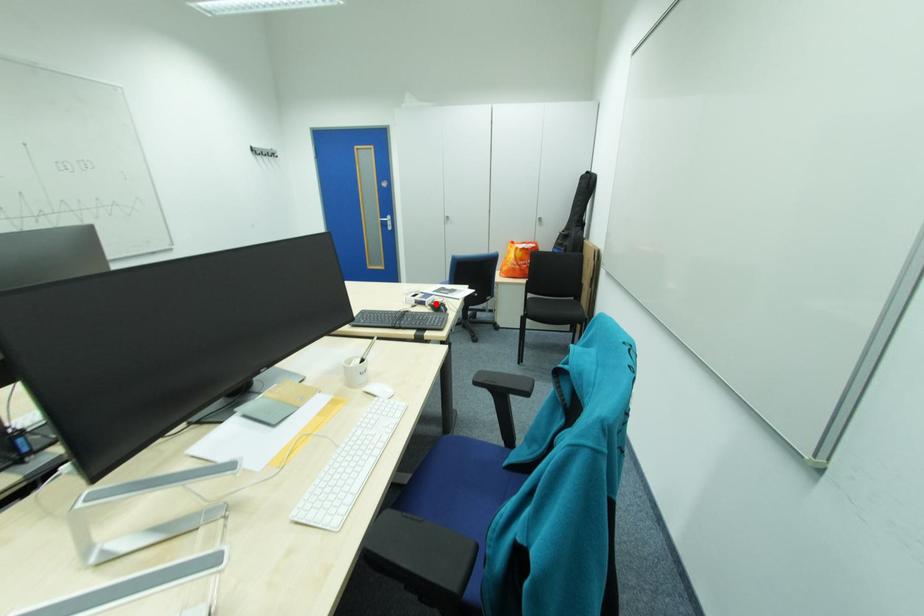
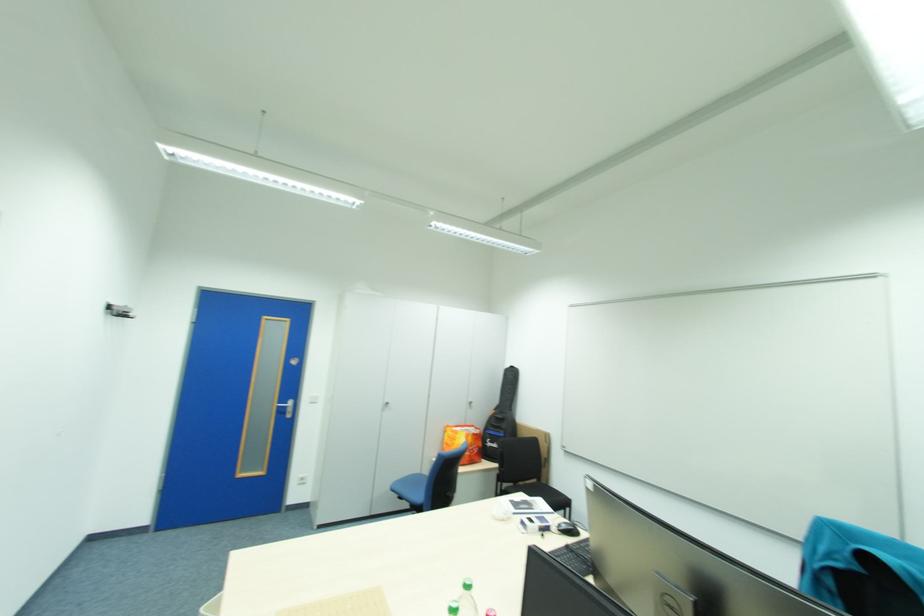
The point at the highlighted location is marked in the first image. Where is the corresponding point in the second image?

(563, 529)